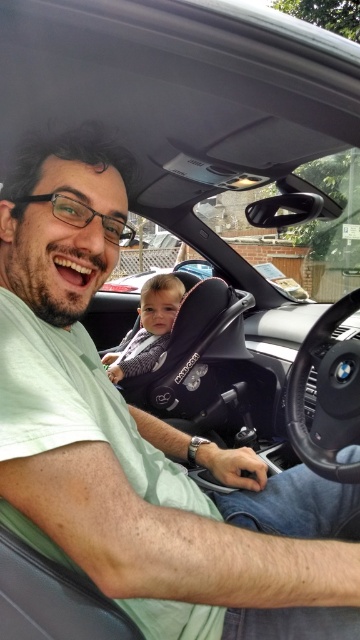
Does black leather steering wheel at center have a greater height compared to soft gray fabric baby car seat at center?

In fact, black leather steering wheel at center may be shorter than soft gray fabric baby car seat at center.

Where is `black leather steering wheel at center`? black leather steering wheel at center is located at coordinates (326, 394).